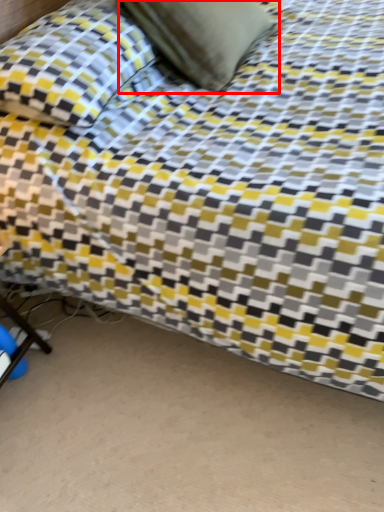
Question: From the image, what is the correct spatial relationship of pillow (annotated by the red box) in relation to pillow?

Choices:
 (A) left
 (B) right

Answer: (B)